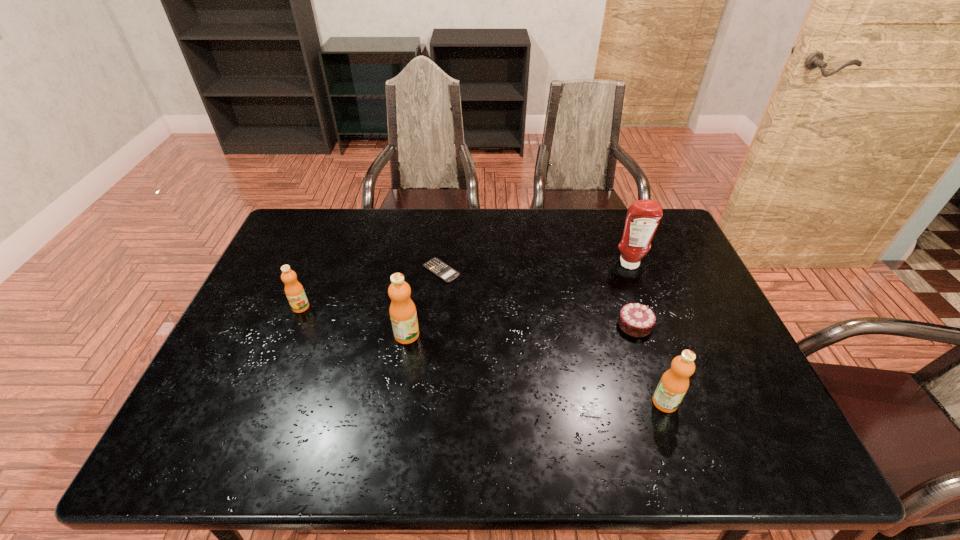
I want to click on the shortest orange juice, so click(x=294, y=291).

The height and width of the screenshot is (540, 960). In order to click on the farthest orange juice in this screenshot , I will do `click(294, 291)`.

Find the location of a particular element. This screenshot has height=540, width=960. the second nearest orange juice is located at coordinates (402, 310).

At what (x,y) coordinates should I click in order to perform the action: click on the rightmost orange juice. Please return your answer as a coordinate pair (x, y). Looking at the image, I should click on (674, 383).

What are the coordinates of `the nearest orange juice` in the screenshot? It's located at (674, 383).

Identify the location of the fifth tallest object. Image resolution: width=960 pixels, height=540 pixels. (637, 320).

What are the coordinates of `condiment` in the screenshot? It's located at (643, 216).

Identify the location of the shortest object. 443,271.

I want to click on free space located 0.240m on the front label of the leftmost object, so coord(268,388).

The height and width of the screenshot is (540, 960). What are the coordinates of `free space located on the front label of the second orange juice from right to left` in the screenshot? It's located at 465,335.